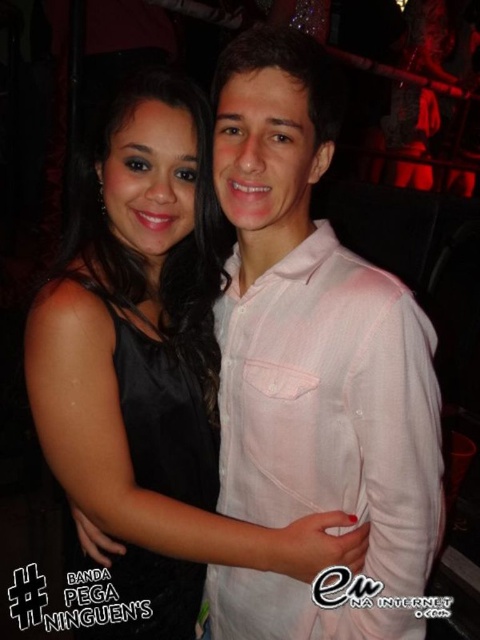
Question: Which point appears farthest from the camera in this image?

Choices:
 (A) (86, 257)
 (B) (232, 387)
 (C) (135, 356)

Answer: (B)

Question: Observing the image, what is the correct spatial positioning of black satin dress at center in reference to black satin dress at left?

Choices:
 (A) below
 (B) above

Answer: (B)

Question: Does black satin dress at center appear over black satin dress at left?

Choices:
 (A) no
 (B) yes

Answer: (B)

Question: Which of the following is the closest to the observer?

Choices:
 (A) black satin dress at left
 (B) pink cotton shirt at center
 (C) black satin dress at center

Answer: (B)

Question: Where is black satin dress at center located in relation to pink cotton shirt at center in the image?

Choices:
 (A) above
 (B) below

Answer: (A)

Question: Which of the following is the closest to the observer?

Choices:
 (A) black satin dress at left
 (B) black satin dress at center

Answer: (B)